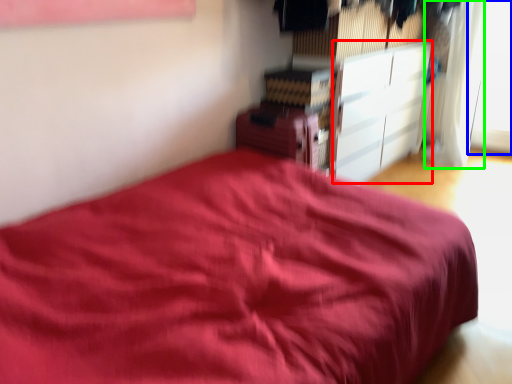
Question: Which object is positioned farthest from cabinetry (highlighted by a red box)? Select from window (highlighted by a blue box) and curtain (highlighted by a green box).

Choices:
 (A) window
 (B) curtain

Answer: (A)